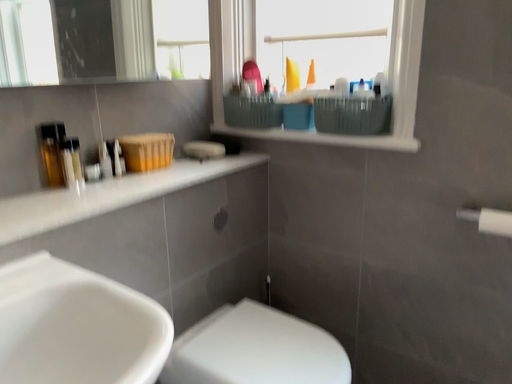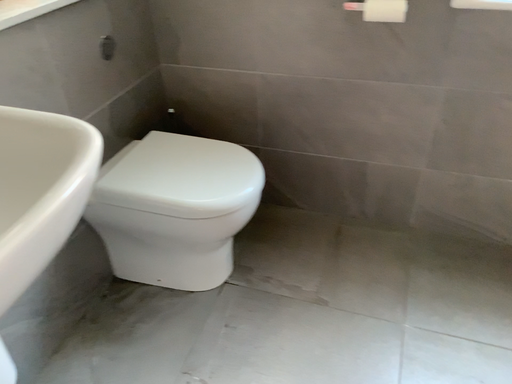
Question: How did the camera likely rotate when shooting the video?

Choices:
 (A) rotated left
 (B) rotated right

Answer: (B)